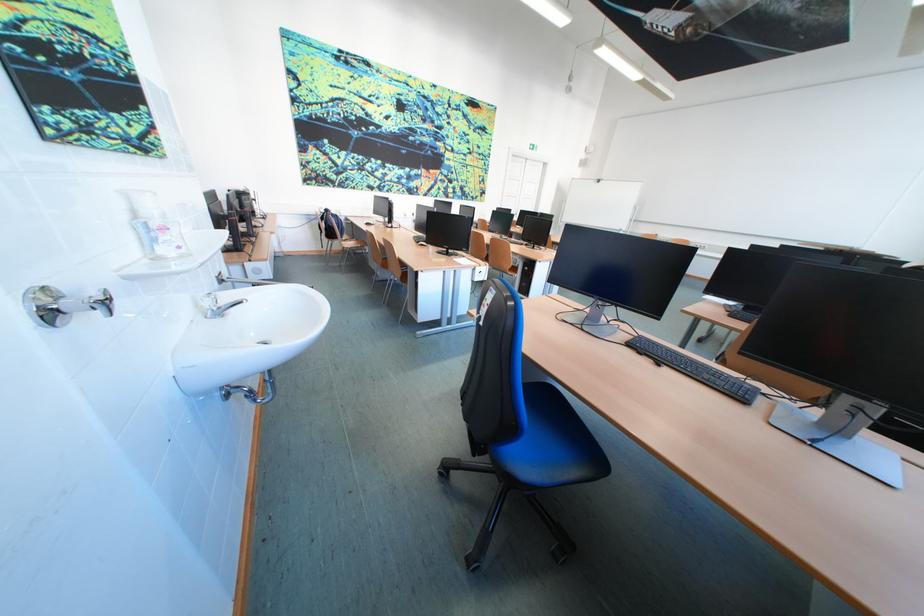
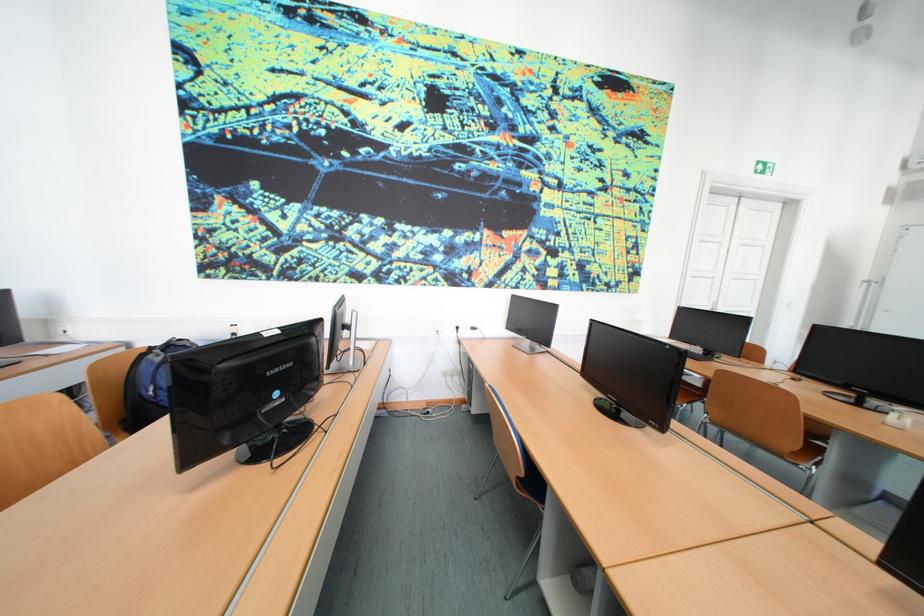
Question: Which direction would the cameraman need to move to produce the second image? Reply with the corresponding letter.

Choices:
 (A) Left
 (B) Right
 (C) Forward
 (D) Backward

Answer: (C)